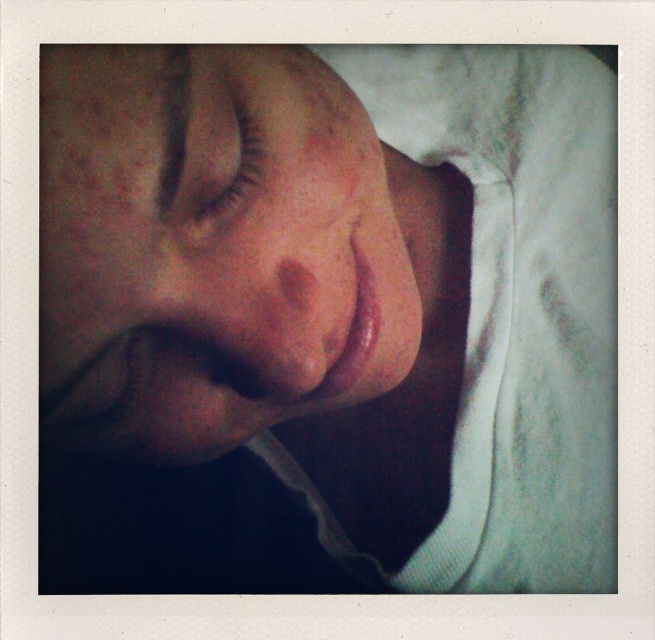
You are a makeup artist preparing to apply eyeliner to the smooth skin face at center. The brown matte eyelashes at upper center are in the way. Can you lift the eyelashes to access the eyelid area without moving the face?

The smooth skin face at center is positioned under the brown matte eyelashes at upper center, so lifting the eyelashes would allow access to the eyelid area without moving the face.

Looking at the person in the image, which object is wider between the smooth skin face at center and the brown matte eyelashes at upper center?

The smooth skin face at center is wider than the brown matte eyelashes at upper center.